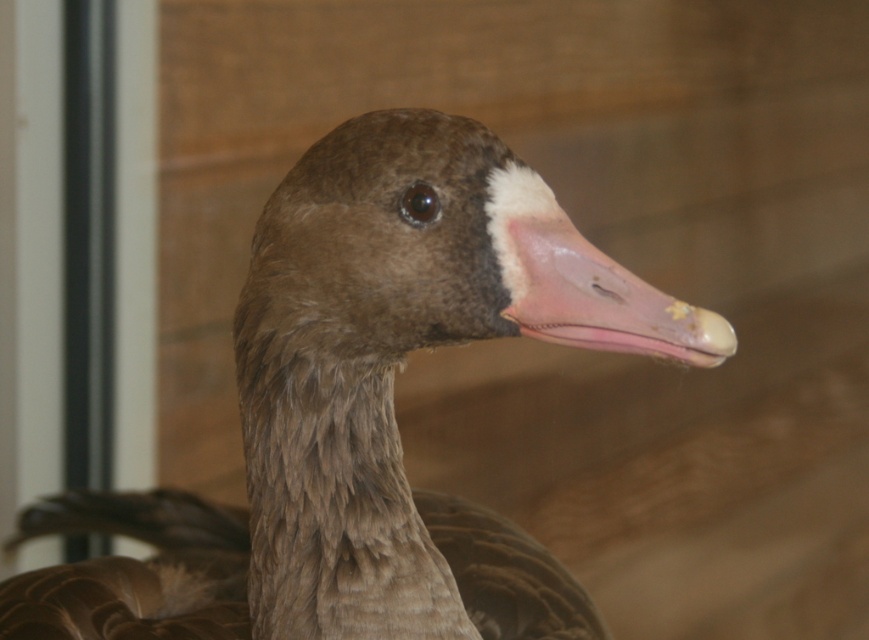
Which of these two, brown feathered duck at center or pink matte beak at center, stands shorter?

pink matte beak at center is shorter.

Does point (357, 380) come farther from viewer compared to point (561, 337)?

Yes, it is.

Does point (204, 564) come closer to viewer compared to point (544, 305)?

No.

This screenshot has width=869, height=640. Find the location of `brown feathered duck at center`. brown feathered duck at center is located at coordinates (363, 410).